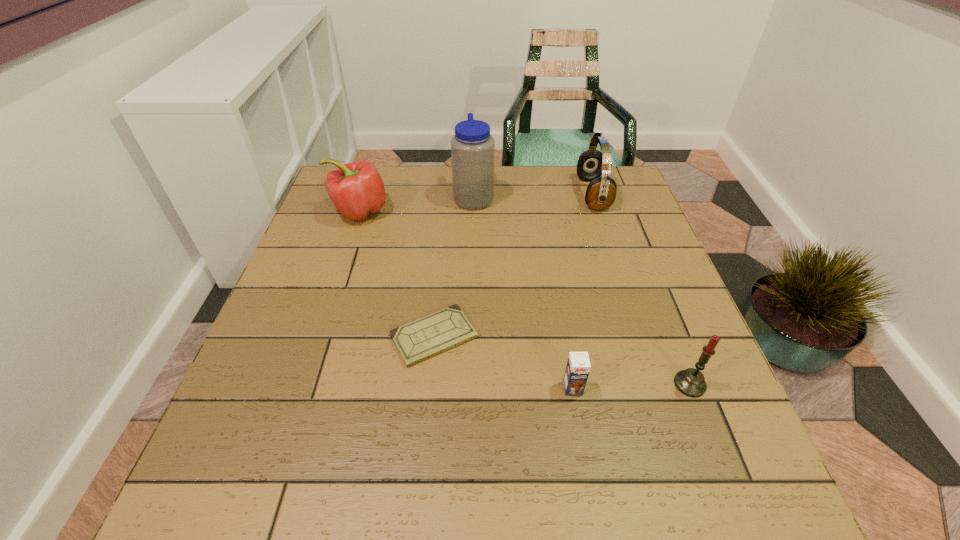
Where is `vacant region located on the ear cups of the headset`? This screenshot has width=960, height=540. vacant region located on the ear cups of the headset is located at coordinates (449, 194).

In order to click on vacant space located 0.350m on the ear cups of the headset in this screenshot , I will do `click(460, 194)`.

Image resolution: width=960 pixels, height=540 pixels. In order to click on free region located on the front of the bell pepper in this screenshot , I will do `click(333, 290)`.

Locate an element on the screen. The image size is (960, 540). vacant area situated on the back of the candle is located at coordinates (663, 317).

The width and height of the screenshot is (960, 540). Find the location of `vacant space located 0.190m on the front label of the second shortest object`. vacant space located 0.190m on the front label of the second shortest object is located at coordinates (593, 504).

Locate an element on the screen. The image size is (960, 540). blank area located on the front of the checkbook is located at coordinates 423,454.

Locate an element on the screen. This screenshot has width=960, height=540. water bottle present at the far edge is located at coordinates (472, 147).

What are the coordinates of `headset located at the far edge` in the screenshot? It's located at (601, 192).

Where is `bell pepper present at the far edge`? This screenshot has height=540, width=960. bell pepper present at the far edge is located at coordinates (356, 189).

Where is `object at the left edge`? object at the left edge is located at coordinates (356, 189).